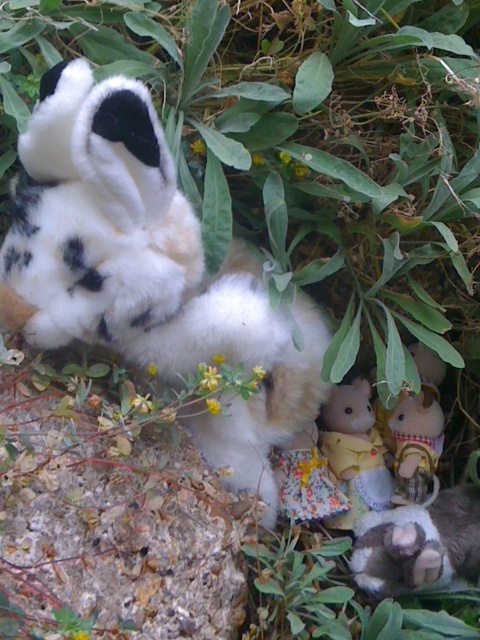
Question: Does yellow fabric doll at lower right appear on the left side of floral fabric doll at center?

Choices:
 (A) no
 (B) yes

Answer: (A)

Question: Considering the relative positions of fluffy fabric doll at center and fluffy white paw at lower right in the image provided, where is fluffy fabric doll at center located with respect to fluffy white paw at lower right?

Choices:
 (A) right
 (B) left

Answer: (B)

Question: Which object is farther from the camera taking this photo?

Choices:
 (A) yellow fabric doll at lower right
 (B) fluffy white paw at lower right
 (C) floral fabric doll at center

Answer: (A)

Question: Can you confirm if fluffy white paw at lower right is positioned above yellow fabric doll at lower right?

Choices:
 (A) no
 (B) yes

Answer: (A)

Question: Which object appears farthest from the camera in this image?

Choices:
 (A) fluffy fabric doll at center
 (B) fluffy white paw at lower right

Answer: (B)

Question: Which of the following is the closest to the observer?

Choices:
 (A) yellow fabric doll at lower right
 (B) floral fabric doll at center

Answer: (B)